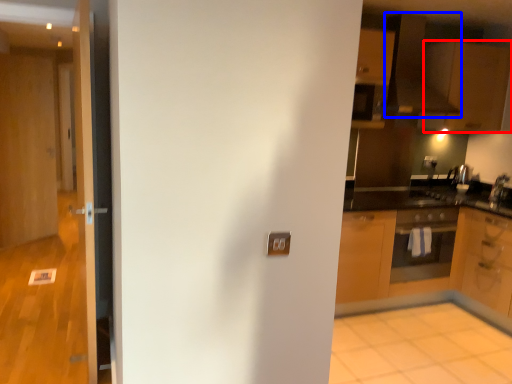
Question: Which of the following is the farthest to the observer, cabinetry (highlighted by a red box) or exhaust hood (highlighted by a blue box)?

Choices:
 (A) cabinetry
 (B) exhaust hood

Answer: (A)